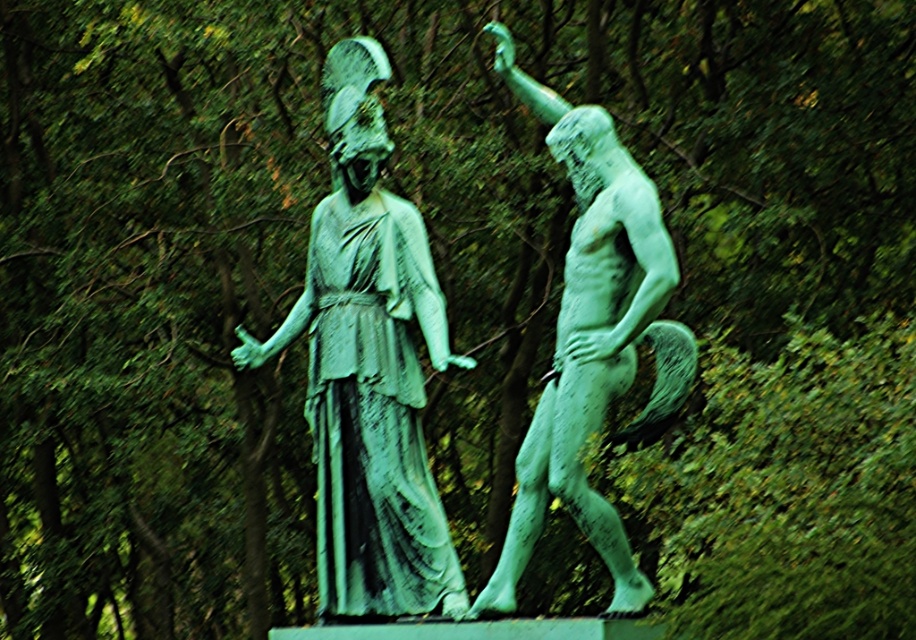
Question: Does green patina statue at center have a larger size compared to green patinated bronze at right?

Choices:
 (A) yes
 (B) no

Answer: (B)

Question: Which point appears closest to the camera in this image?

Choices:
 (A) (522, 460)
 (B) (385, 461)

Answer: (A)

Question: Is green patina statue at center positioned in front of green patinated bronze at right?

Choices:
 (A) no
 (B) yes

Answer: (A)

Question: Among these points, which one is farthest from the camera?

Choices:
 (A) (281, 323)
 (B) (576, 241)

Answer: (A)

Question: Is green patina statue at center further to camera compared to green patinated bronze at right?

Choices:
 (A) yes
 (B) no

Answer: (A)